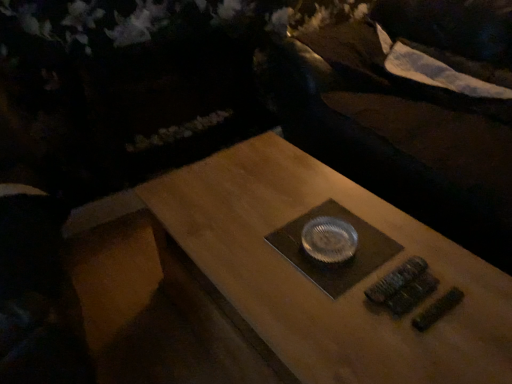
Where is `free space above wooden table at center (from a real-world perspective)`? The width and height of the screenshot is (512, 384). free space above wooden table at center (from a real-world perspective) is located at coordinates [x=325, y=246].